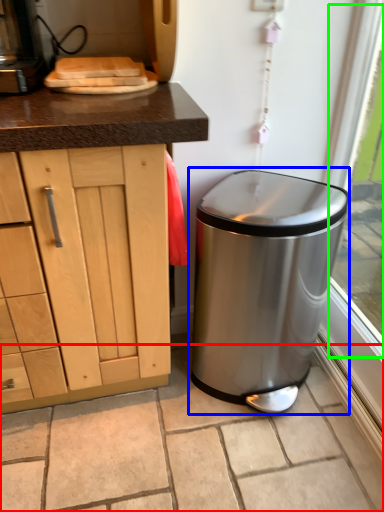
Question: Estimate the real-world distances between objects in this image. Which object is closer to granite (highlighted by a red box), waste container (highlighted by a blue box) or window screen (highlighted by a green box)?

Choices:
 (A) waste container
 (B) window screen

Answer: (A)